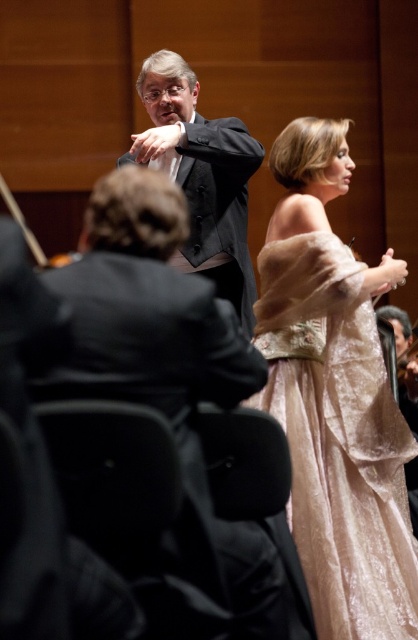
Which of these two, velvet beige gown at center or dark gray suit at center, stands shorter?

dark gray suit at center

Can you confirm if velvet beige gown at center is wider than dark gray suit at center?

No, velvet beige gown at center is not wider than dark gray suit at center.

Who is more forward, (402,276) or (188,161)?

Point (402,276) is more forward.

Locate an element on the screen. The image size is (418, 640). velvet beige gown at center is located at coordinates (334, 397).

Measure the distance between matte black suit at center and dark gray suit at center.

matte black suit at center is 7.25 meters from dark gray suit at center.

Can you confirm if matte black suit at center is positioned to the left of dark gray suit at center?

Incorrect, matte black suit at center is not on the left side of dark gray suit at center.

Does point (218, 540) lie behind point (234, 184)?

No, (218, 540) is closer to viewer.

Where is `matte black suit at center`? Image resolution: width=418 pixels, height=640 pixels. matte black suit at center is located at coordinates (175, 390).

Is velvet beige gown at center wider than matte black suit at center?

No, velvet beige gown at center is not wider than matte black suit at center.

This screenshot has width=418, height=640. Describe the element at coordinates (334, 397) in the screenshot. I see `velvet beige gown at center` at that location.

Is point (405, 426) behind point (137, 305)?

Yes, it is.

Locate an element on the screen. The width and height of the screenshot is (418, 640). velvet beige gown at center is located at coordinates (334, 397).